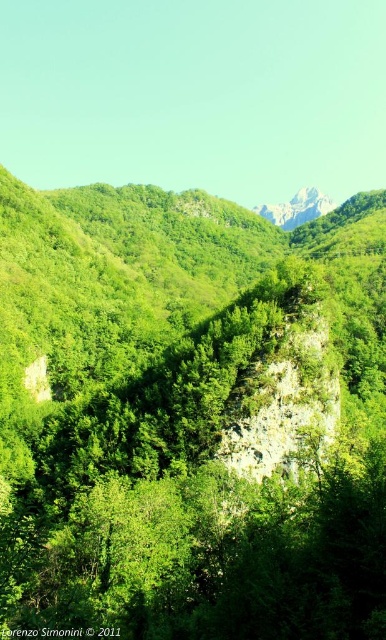
Question: Does green leafy tree at center have a lesser width compared to white rocky mountain at upper center?

Choices:
 (A) yes
 (B) no

Answer: (B)

Question: Is green leafy tree at center positioned behind white rocky mountain at upper center?

Choices:
 (A) yes
 (B) no

Answer: (B)

Question: Is green leafy tree at center to the left of white rocky mountain at upper center from the viewer's perspective?

Choices:
 (A) no
 (B) yes

Answer: (B)

Question: Which point is farther from the camera taking this photo?

Choices:
 (A) (313, 198)
 (B) (35, 352)

Answer: (A)